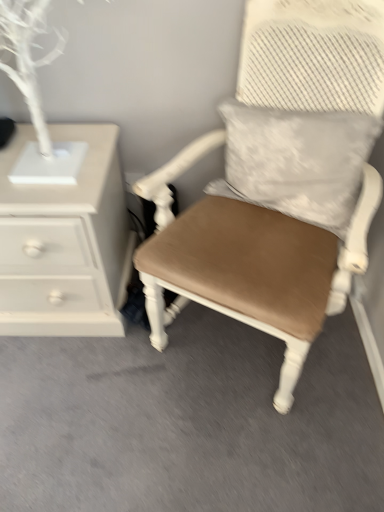
Question: Is matte brown cushioned chair at center in front of or behind white painted wood chest of drawers at left in the image?

Choices:
 (A) behind
 (B) front

Answer: (B)

Question: Based on their sizes in the image, would you say matte brown cushioned chair at center is bigger or smaller than white painted wood chest of drawers at left?

Choices:
 (A) big
 (B) small

Answer: (A)

Question: Considering the real-world distances, which object is closest to the white painted wood chest of drawers at left?

Choices:
 (A) matte brown cushioned chair at center
 (B) white textured pillow at upper right

Answer: (A)

Question: Which object is positioned farthest from the matte brown cushioned chair at center?

Choices:
 (A) white painted wood chest of drawers at left
 (B) white textured pillow at upper right

Answer: (A)